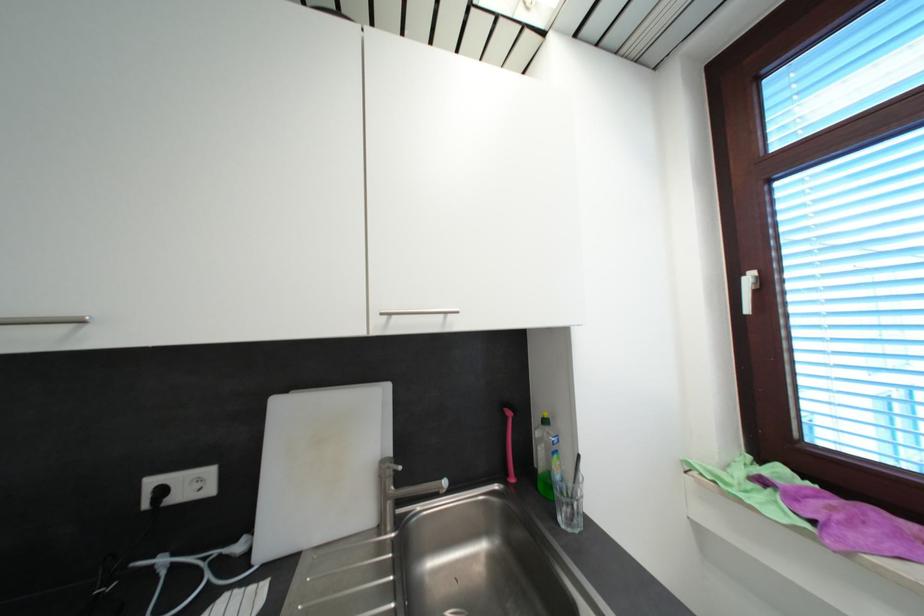
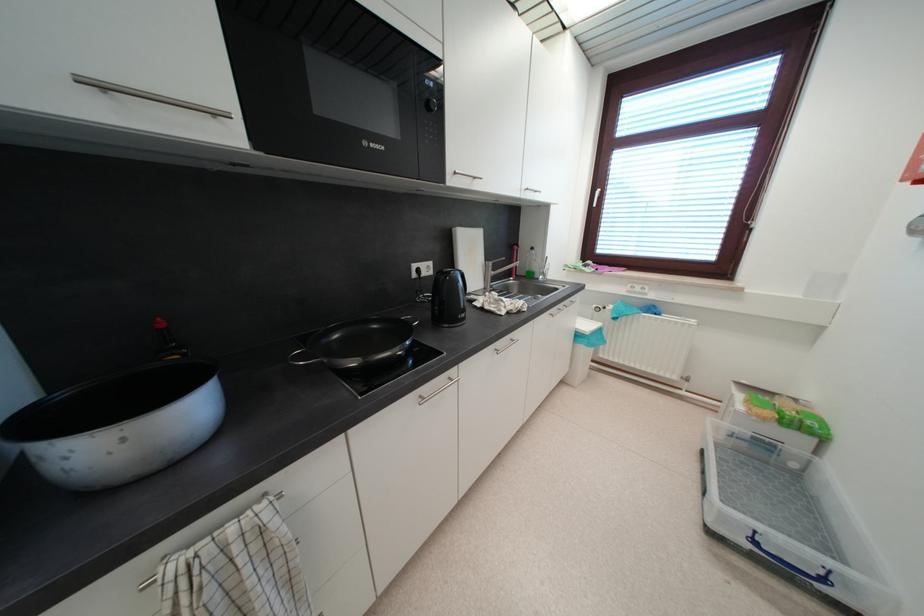
Find the pixel in the second image that matches [395,315] in the first image.

(530, 192)